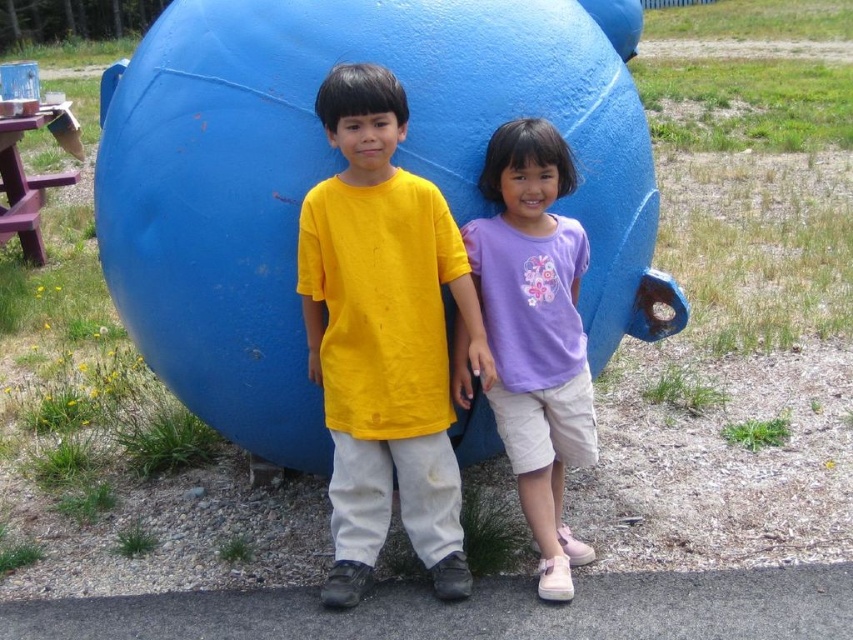
Can you confirm if blue matte ball at center is shorter than yellow cotton shirt at center?

No.

The image size is (853, 640). Find the location of `blue matte ball at center`. blue matte ball at center is located at coordinates (338, 170).

Does point (270, 252) lie behind point (387, 476)?

No, it is in front of (387, 476).

Find the location of a particular element. blue matte ball at center is located at coordinates (338, 170).

Is purple cotton shirt at center thinner than purple wood picnic table at left?

Indeed, purple cotton shirt at center has a lesser width compared to purple wood picnic table at left.

Does purple cotton shirt at center have a smaller size compared to purple wood picnic table at left?

Yes.

Between point (462, 332) and point (15, 179), which one is positioned behind?

Point (15, 179)

Find the location of `purple cotton shirt at center`. purple cotton shirt at center is located at coordinates (535, 332).

Is blue matte ball at center to the left of purple wood picnic table at left from the viewer's perspective?

No, blue matte ball at center is not to the left of purple wood picnic table at left.

Is blue matte ball at center wider than purple wood picnic table at left?

Yes, blue matte ball at center is wider than purple wood picnic table at left.

What do you see at coordinates (338, 170) in the screenshot?
I see `blue matte ball at center` at bounding box center [338, 170].

At what (x,y) coordinates should I click in order to perform the action: click on blue matte ball at center. Please return your answer as a coordinate pair (x, y). The width and height of the screenshot is (853, 640). Looking at the image, I should click on (338, 170).